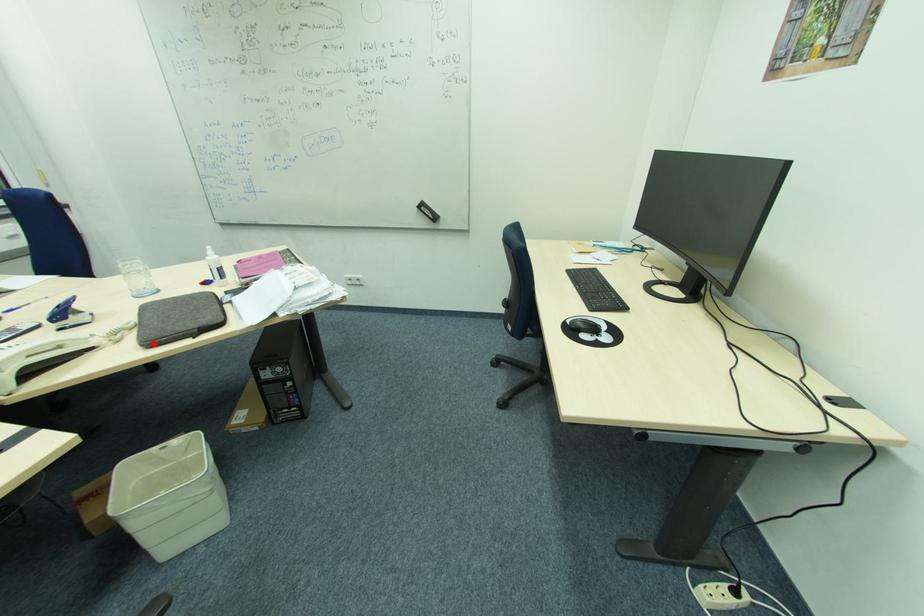
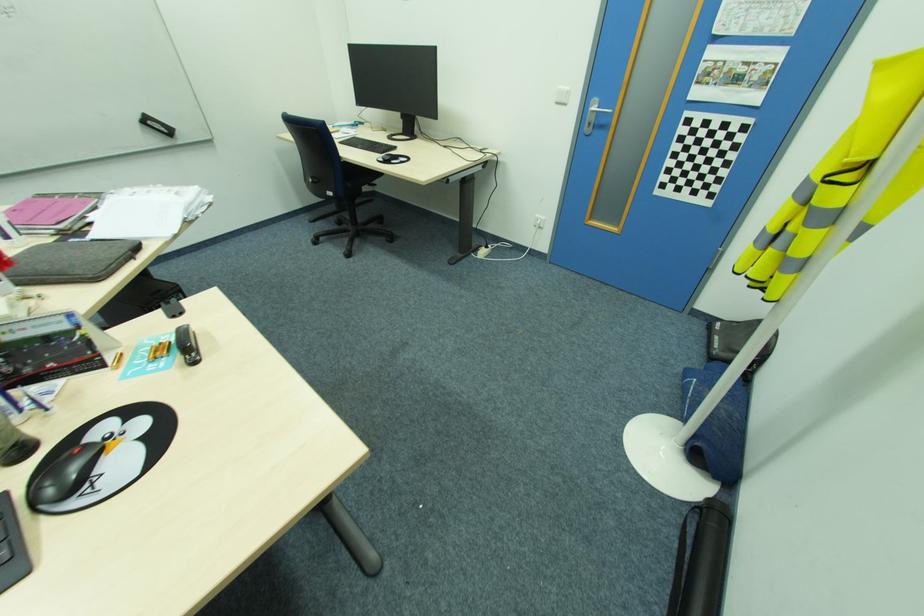
Where in the second image is the point corresponding to the highlighted location from the first image?

(99, 278)